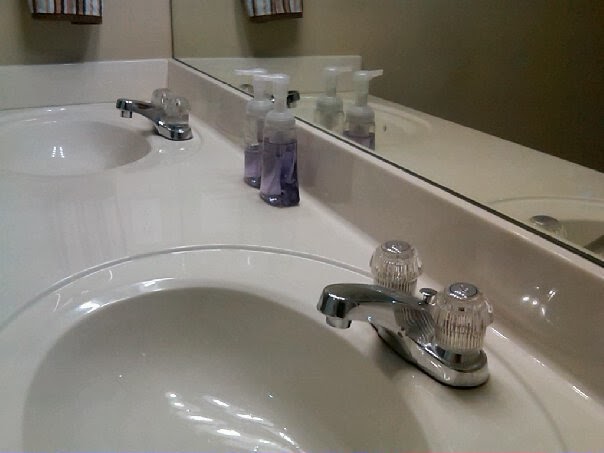
Image resolution: width=604 pixels, height=453 pixels. Find the location of `soap dispenser bottle`. soap dispenser bottle is located at coordinates point(280,154), point(255,139).